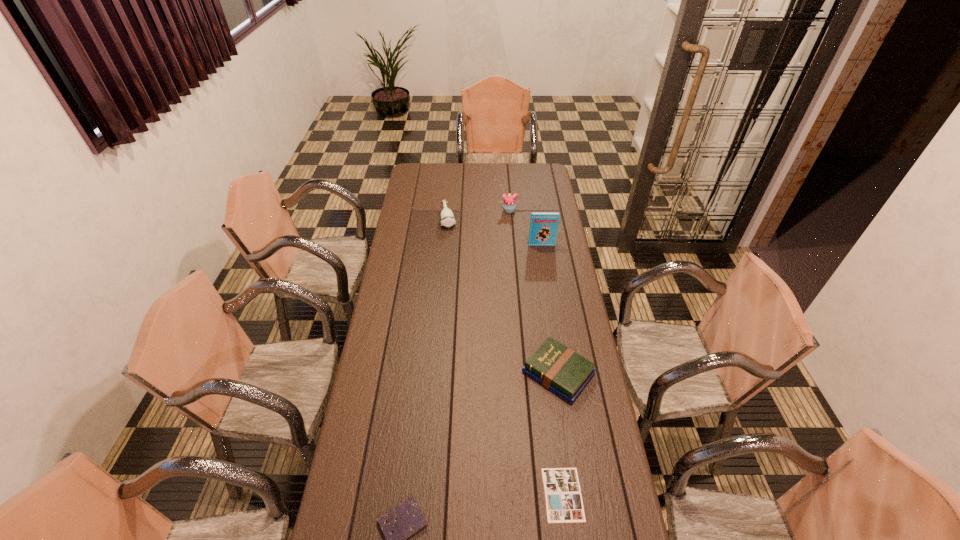
Image resolution: width=960 pixels, height=540 pixels. I want to click on the tallest object, so click(543, 225).

Image resolution: width=960 pixels, height=540 pixels. In order to click on the third farthest object in this screenshot , I will do `click(543, 225)`.

Where is `the fifth shortest object`? the fifth shortest object is located at coordinates (509, 205).

This screenshot has height=540, width=960. In order to click on bottle in this screenshot , I will do tap(447, 218).

Where is `the third shortest object`? the third shortest object is located at coordinates (558, 368).

This screenshot has width=960, height=540. What are the coordinates of `the fourth farthest object` in the screenshot? It's located at (558, 368).

Identify the location of the nearest book. (563, 498).

Where is `the shortest object`? The height and width of the screenshot is (540, 960). the shortest object is located at coordinates (563, 498).

This screenshot has width=960, height=540. What are the coordinates of `vacant space located 0.240m on the front cover of the third farthest object` in the screenshot? It's located at (547, 278).

Where is `free location located on the face of the fifth shortest object`? Image resolution: width=960 pixels, height=540 pixels. free location located on the face of the fifth shortest object is located at coordinates (510, 220).